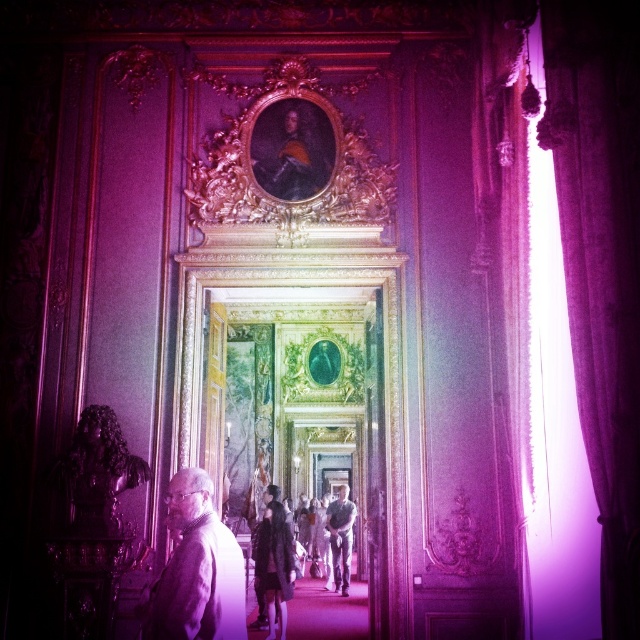
Is gray wool sweater at lower left shorter than leather jacket at center?

Indeed, gray wool sweater at lower left has a lesser height compared to leather jacket at center.

Does gray wool sweater at lower left lie in front of leather jacket at center?

Yes, it is.

Is point (179, 532) positioned behind point (266, 624)?

That is False.

The width and height of the screenshot is (640, 640). Find the location of `gray wool sweater at lower left`. gray wool sweater at lower left is located at coordinates (196, 570).

Image resolution: width=640 pixels, height=640 pixels. What do you see at coordinates (602, 262) in the screenshot?
I see `silky purple curtain at right` at bounding box center [602, 262].

Is silky purple curtain at right smaller than leather jacket at center?

Yes.

At what (x,y) coordinates should I click in order to perform the action: click on silky purple curtain at right. Please return your answer as a coordinate pair (x, y). The height and width of the screenshot is (640, 640). Looking at the image, I should click on (602, 262).

Based on the photo, is silky purple curtain at right further to the viewer compared to dark gray fabric jacket at center?

That is False.

Can you confirm if silky purple curtain at right is positioned above dark gray fabric jacket at center?

Yes.

At what (x,y) coordinates should I click in order to perform the action: click on silky purple curtain at right. Please return your answer as a coordinate pair (x, y). This screenshot has width=640, height=640. Looking at the image, I should click on click(602, 262).